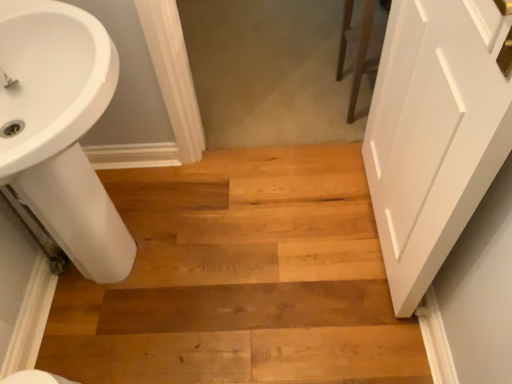
Question: Is white glossy sink at lower left positioned with its back to white matte door at right?

Choices:
 (A) yes
 (B) no

Answer: (B)

Question: Is the position of white glossy sink at lower left more distant than that of white matte door at right?

Choices:
 (A) no
 (B) yes

Answer: (B)

Question: Is white glossy sink at lower left beside white matte door at right?

Choices:
 (A) yes
 (B) no

Answer: (B)

Question: Is white glossy sink at lower left at the left side of white matte door at right?

Choices:
 (A) no
 (B) yes

Answer: (B)

Question: Is white glossy sink at lower left smaller than white matte door at right?

Choices:
 (A) yes
 (B) no

Answer: (B)

Question: Is white glossy sink at lower left in front of or behind natural wood floor at center in the image?

Choices:
 (A) behind
 (B) front

Answer: (B)

Question: Is white glossy sink at lower left spatially inside natural wood floor at center, or outside of it?

Choices:
 (A) outside
 (B) inside

Answer: (A)

Question: From a real-world perspective, is white glossy sink at lower left physically located above or below natural wood floor at center?

Choices:
 (A) below
 (B) above

Answer: (B)

Question: Is point (76, 140) closer or farther from the camera than point (141, 210)?

Choices:
 (A) closer
 (B) farther

Answer: (A)

Question: Is natural wood floor at center inside the boundaries of white matte door at right, or outside?

Choices:
 (A) outside
 (B) inside

Answer: (A)

Question: Considering their positions, is natural wood floor at center located in front of or behind white matte door at right?

Choices:
 (A) behind
 (B) front

Answer: (A)

Question: Considering the positions of natural wood floor at center and white matte door at right in the image, is natural wood floor at center bigger or smaller than white matte door at right?

Choices:
 (A) small
 (B) big

Answer: (B)

Question: Is natural wood floor at center taller or shorter than white matte door at right?

Choices:
 (A) short
 (B) tall

Answer: (A)

Question: Is white matte door at right inside or outside of white glossy sink at lower left?

Choices:
 (A) outside
 (B) inside

Answer: (A)

Question: Is white matte door at right wider or thinner than white glossy sink at lower left?

Choices:
 (A) wide
 (B) thin

Answer: (B)